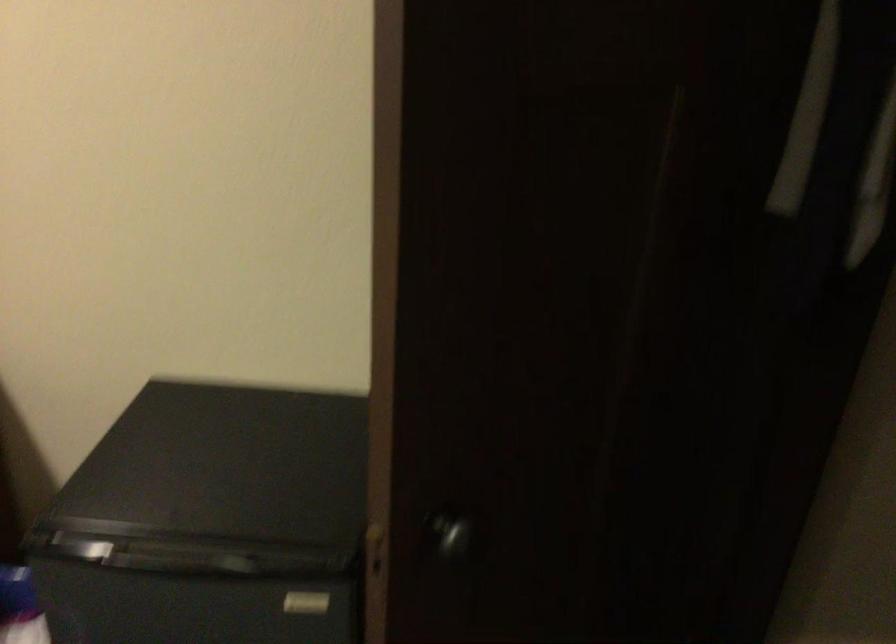
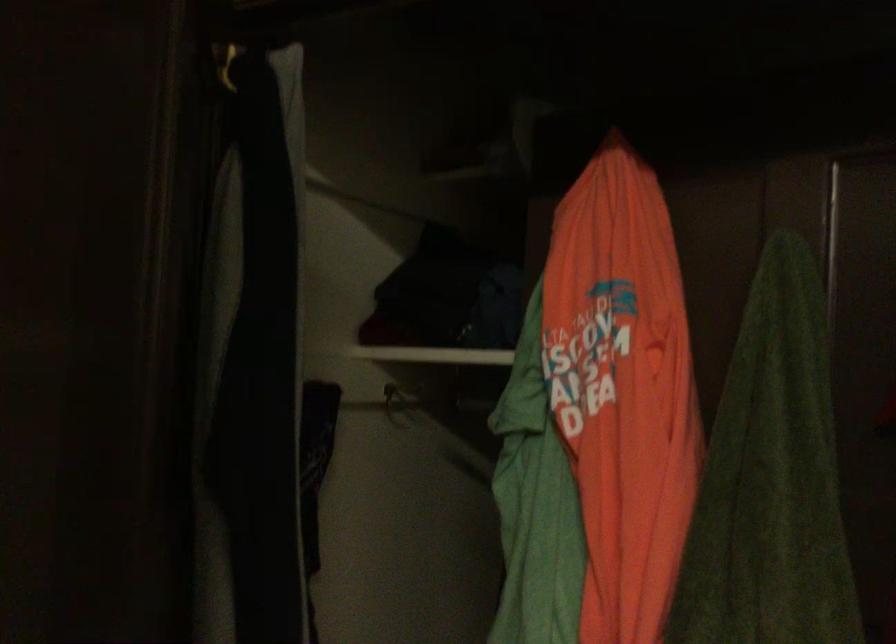
Question: The images are taken continuously from a first-person perspective. In which direction is your viewpoint rotating?

Choices:
 (A) Left
 (B) Right
 (C) Up
 (D) Down

Answer: (B)